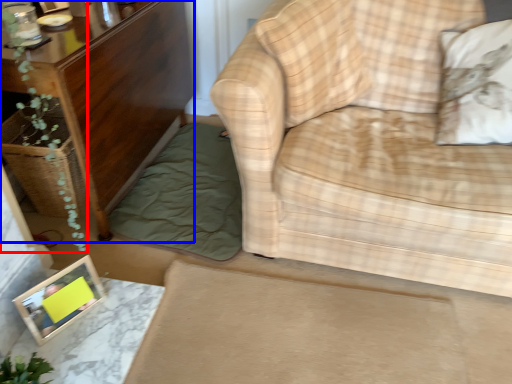
Question: Among these objects, which one is nearest to the camera, plant (highlighted by a red box) or furniture (highlighted by a blue box)?

Choices:
 (A) plant
 (B) furniture

Answer: (A)